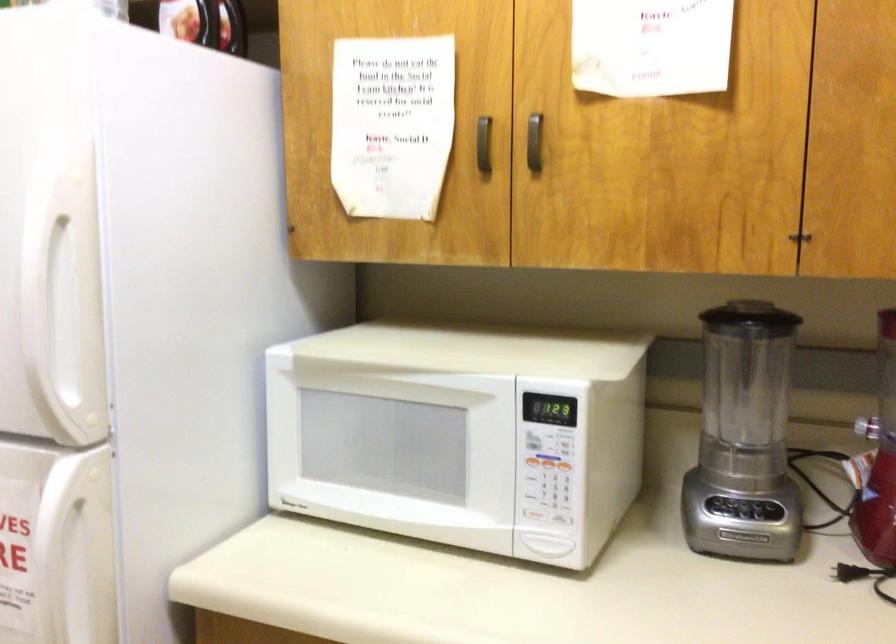
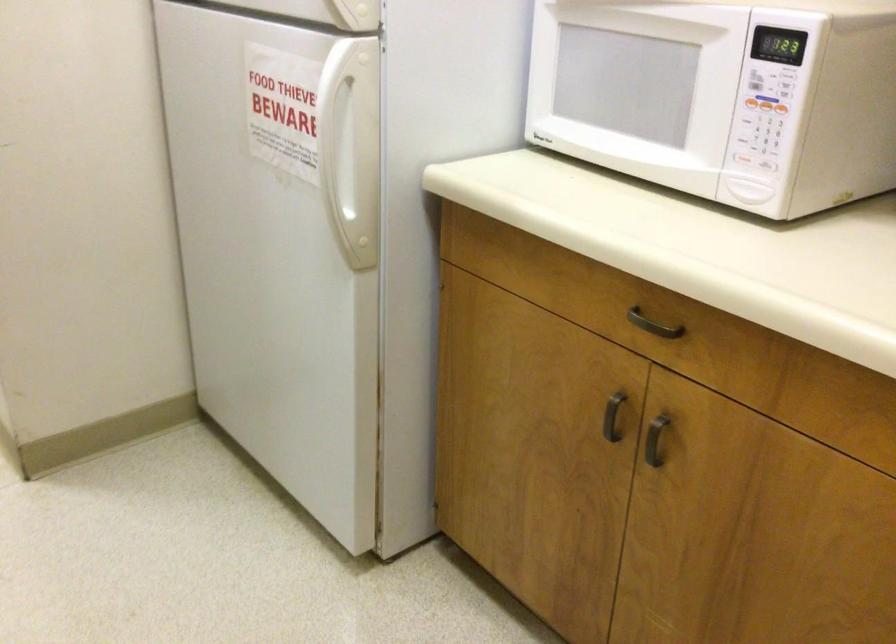
Locate, in the second image, the point that corresponds to (569,469) in the first image.

(780, 108)